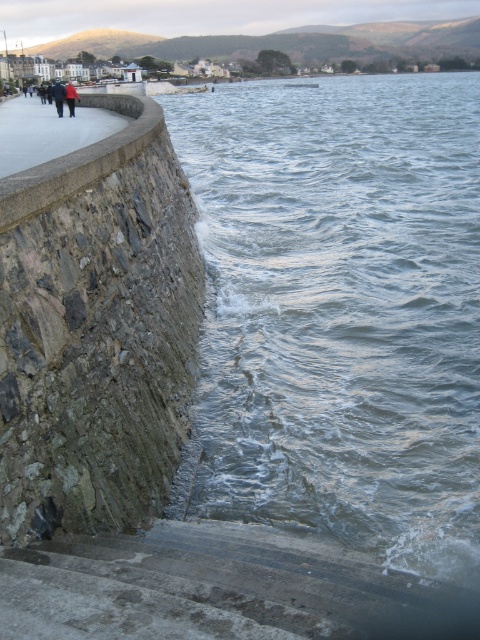
Does dark blue jacket at upper left have a smaller size compared to red jacket at upper left?

No.

Does dark blue jacket at upper left appear over red jacket at upper left?

Yes.

Which is in front, point (60, 97) or point (72, 96)?

Point (60, 97) is in front.

You are a GUI agent. You are given a task and a screenshot of the screen. Output one action in this format:
    pyautogui.click(x=<x>, y=<y>)
    Task: Click on the dark blue jacket at upper left
    Image resolution: width=480 pixels, height=640 pixels.
    Given the screenshot: What is the action you would take?
    pyautogui.click(x=59, y=97)

Is concrete walkway at left smaller than dark blue jacket at upper left?

Yes.

Who is higher up, concrete walkway at left or dark blue jacket at upper left?

Positioned higher is dark blue jacket at upper left.

Locate an element on the screen. This screenshot has width=480, height=640. concrete walkway at left is located at coordinates (48, 131).

Identify the location of concrete walkway at left. The width and height of the screenshot is (480, 640). (48, 131).

Is point (111, 497) positioned in front of point (23, 122)?

Yes, point (111, 497) is closer to viewer.

Is point (40, 404) positioned behind point (28, 166)?

No, it is in front of (28, 166).

Where is `gray stone wall at left`? The height and width of the screenshot is (640, 480). gray stone wall at left is located at coordinates (96, 330).